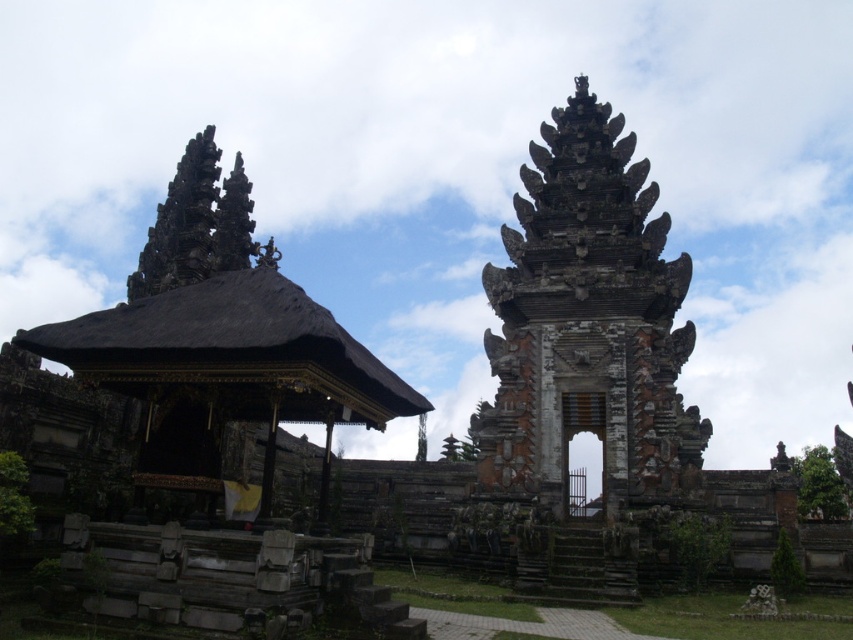
Question: Is dark brown stone temple at right to the right of black stone gazebo at center from the viewer's perspective?

Choices:
 (A) no
 (B) yes

Answer: (B)

Question: From the image, what is the correct spatial relationship of dark brown stone temple at right in relation to black stone gazebo at center?

Choices:
 (A) right
 (B) left

Answer: (A)

Question: Can you confirm if dark brown stone temple at right is positioned below black stone gazebo at center?

Choices:
 (A) no
 (B) yes

Answer: (A)